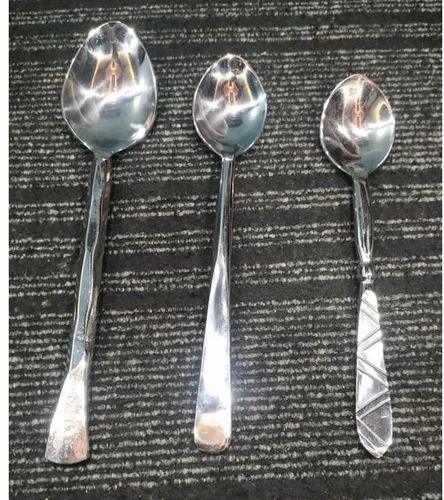
This screenshot has height=500, width=444. I want to click on handle, so click(75, 363).